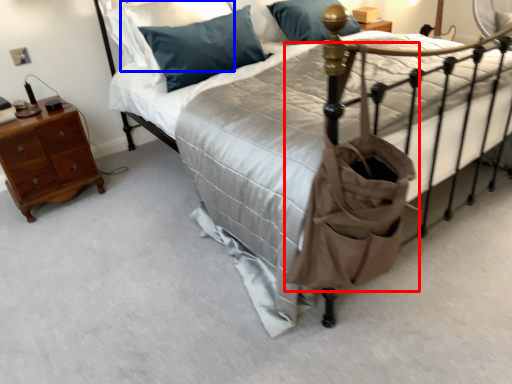
Question: Which of the following is the closest to the observer, bag (highlighted by a red box) or pillow (highlighted by a blue box)?

Choices:
 (A) bag
 (B) pillow

Answer: (A)